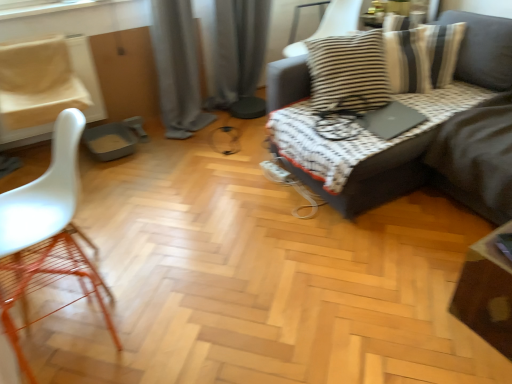
Locate an element on the screen. The image size is (512, 384). vacant region in front of gray fabric curtain at center, the first curtain when ordered from left to right is located at coordinates (175, 160).